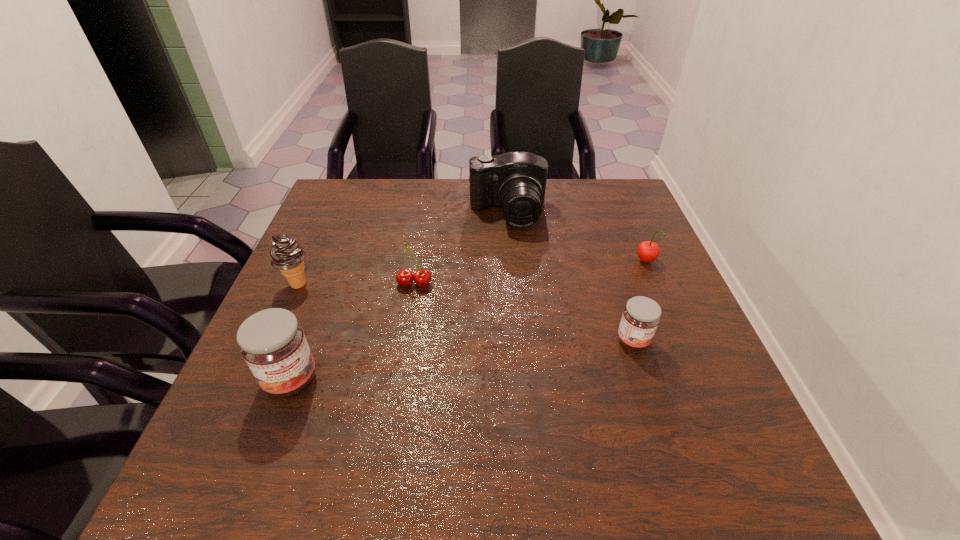
The height and width of the screenshot is (540, 960). I want to click on vacant space that is in between the right cherry and the left cherry, so click(530, 273).

Find the location of `vacant space that is in between the icecream and the rightmost object`. vacant space that is in between the icecream and the rightmost object is located at coordinates (471, 273).

The image size is (960, 540). Identify the location of vacant point located between the fourth object from right to left and the rightmost object. (530, 273).

Find the location of a particular element. This screenshot has height=540, width=960. vacant space that is in between the nearer cherry and the icecream is located at coordinates point(356,284).

Locate an element on the screen. free space that is in between the fifth nearest object and the camera is located at coordinates coord(577,238).

You are a GUI agent. You are given a task and a screenshot of the screen. Output one action in this format:
    pyautogui.click(x=<x>, y=<y>)
    Task: Click on the unoccupied position between the nearest object and the camera
    The height and width of the screenshot is (540, 960).
    Given the screenshot: What is the action you would take?
    pyautogui.click(x=399, y=296)

Where is `vacant space in between the second nearest object and the third object from right to left`? vacant space in between the second nearest object and the third object from right to left is located at coordinates (570, 277).

This screenshot has width=960, height=540. I want to click on vacant region between the third object from right to left and the right cherry, so click(x=577, y=238).

At what (x,y) coordinates should I click in order to perform the action: click on vacant space that's between the right jam and the icecream. Please return your answer as a coordinate pair (x, y). The width and height of the screenshot is (960, 540). Looking at the image, I should click on (466, 313).

The width and height of the screenshot is (960, 540). In order to click on free space between the farther cherry and the fourth object from right to left in this screenshot , I will do `click(530, 273)`.